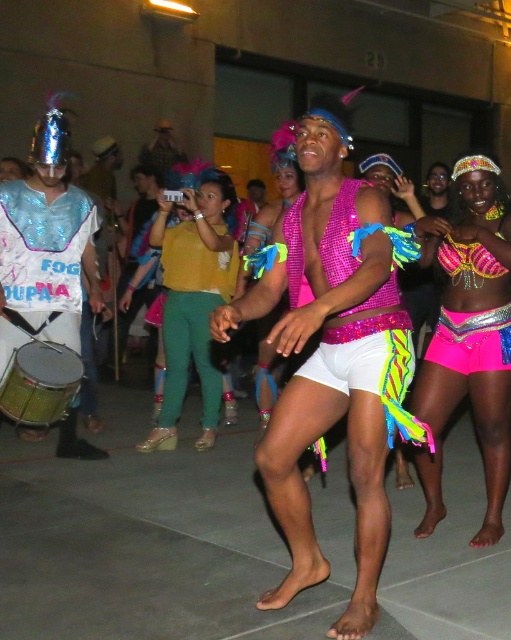
Is pink sequined top at center positioned behind gold metallic drum at lower left?

No.

Which is above, pink sequined top at center or gold metallic drum at lower left?

pink sequined top at center is higher up.

What do you see at coordinates (375, 308) in the screenshot?
I see `pink sequined top at center` at bounding box center [375, 308].

This screenshot has height=640, width=511. Identify the location of pink sequined top at center. (375, 308).

Can you confirm if matte yellow shirt at center is smaller than pink sequined top at center?

Incorrect, matte yellow shirt at center is not smaller in size than pink sequined top at center.

Can you confirm if matte yellow shirt at center is positioned to the right of pink sequined top at center?

No, matte yellow shirt at center is not to the right of pink sequined top at center.

Who is more forward, (165, 275) or (301, 211)?

Positioned in front is point (301, 211).

Image resolution: width=511 pixels, height=640 pixels. I want to click on matte yellow shirt at center, so click(193, 300).

Between neon pink sequined shorts at center and pink sequined top at center, which one has less height?

pink sequined top at center

Image resolution: width=511 pixels, height=640 pixels. I want to click on neon pink sequined shorts at center, so click(x=470, y=339).